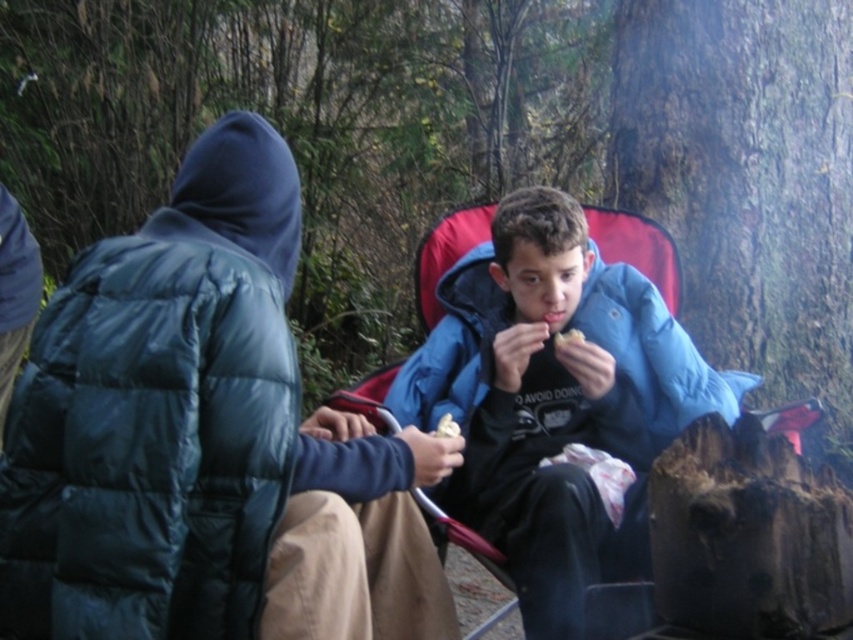
Question: Which is farther from the white crumbly snack at center?

Choices:
 (A) white crumbly bread at center
 (B) dark blue puffy jacket at center

Answer: (B)

Question: Can you confirm if blue puffy jacket at center is positioned below white crumbly snack at center?

Choices:
 (A) no
 (B) yes

Answer: (B)

Question: Does white crumbly bread at center have a smaller size compared to white crumbly snack at center?

Choices:
 (A) yes
 (B) no

Answer: (B)

Question: Can you confirm if dark blue puffy jacket at center is smaller than white crumbly bread at center?

Choices:
 (A) yes
 (B) no

Answer: (B)

Question: Which of the following is the closest to the observer?

Choices:
 (A) dark blue puffy jacket at center
 (B) white crumbly bread at center
 (C) white crumbly snack at center

Answer: (A)

Question: Which point is closer to the camera taking this photo?

Choices:
 (A) (639, 332)
 (B) (579, 330)
 (C) (49, 394)

Answer: (C)